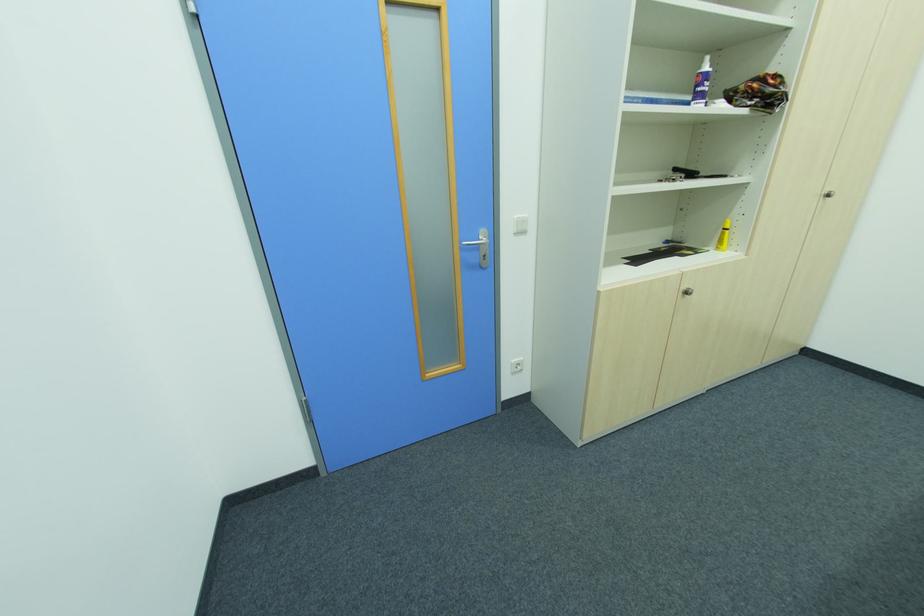
Image resolution: width=924 pixels, height=616 pixels. What do you see at coordinates (478, 238) in the screenshot?
I see `the silver door handle` at bounding box center [478, 238].